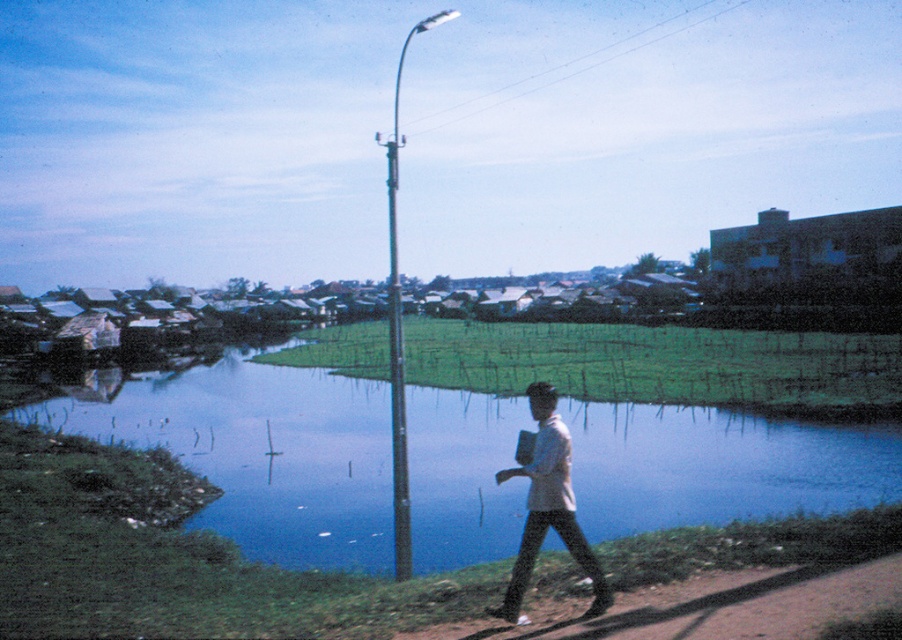
You are a hiker trying to cross the brown dirt path at lower right while avoiding the smooth metallic pole at center. Can you pass through the path without touching the pole?

The brown dirt path at lower right has a lesser width compared to smooth metallic pole at center, so the path is narrower than the pole. This means the path is too narrow to pass through without touching the pole.

You are standing at the dirt path and see the blue water at center and the smooth metallic pole at center. Which object is positioned to the right of the other?

The blue water at center is to the right of the smooth metallic pole at center.